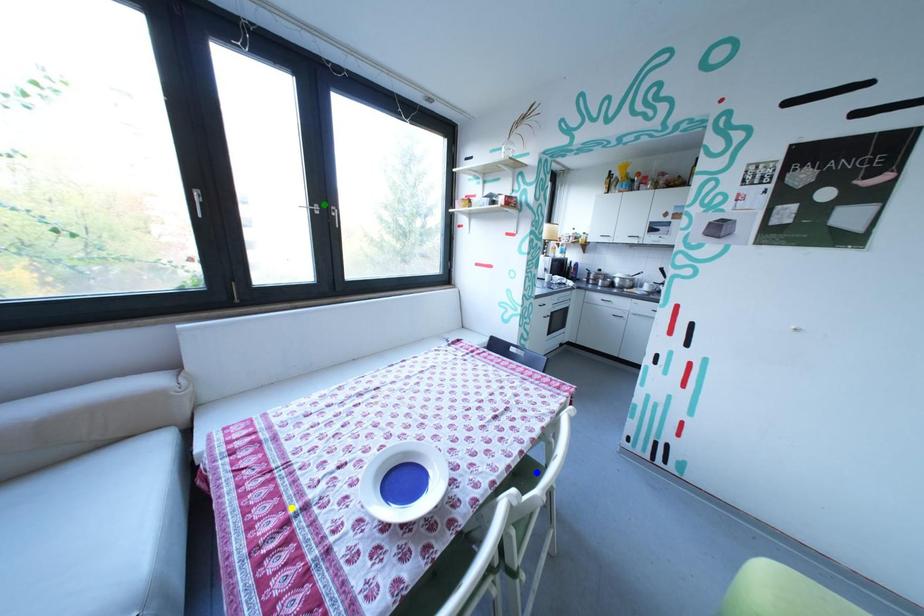
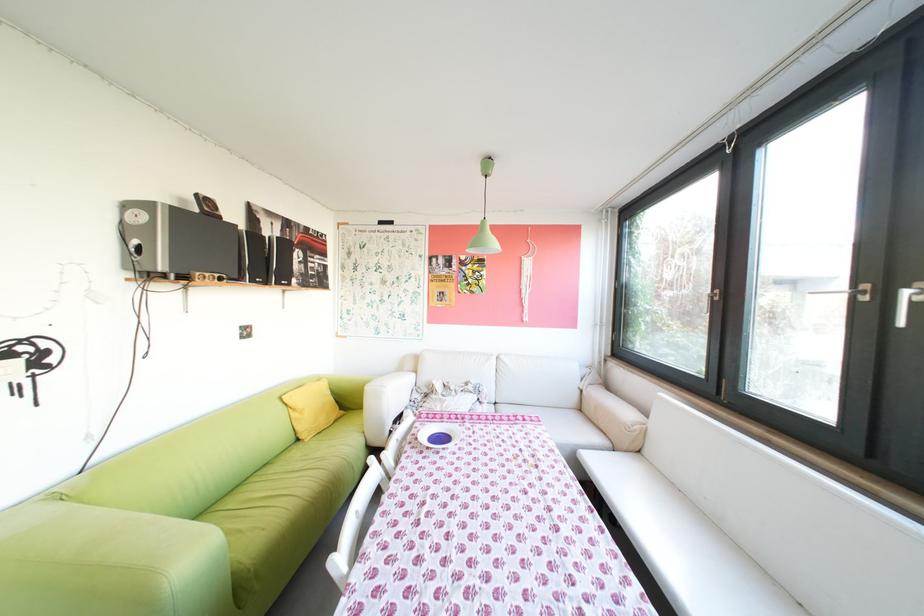
I am providing you with two images of the same scene from different viewpoints. Three points are marked in image1. Which point corresponds to a part or object that is occluded in image2?In image1, three points are marked. Which of them correspond to a part or object that is occluded in image2?Among the three points shown in image1, which one corresponds to a part or object that is no longer visible due to occlusion in image2?

blue point